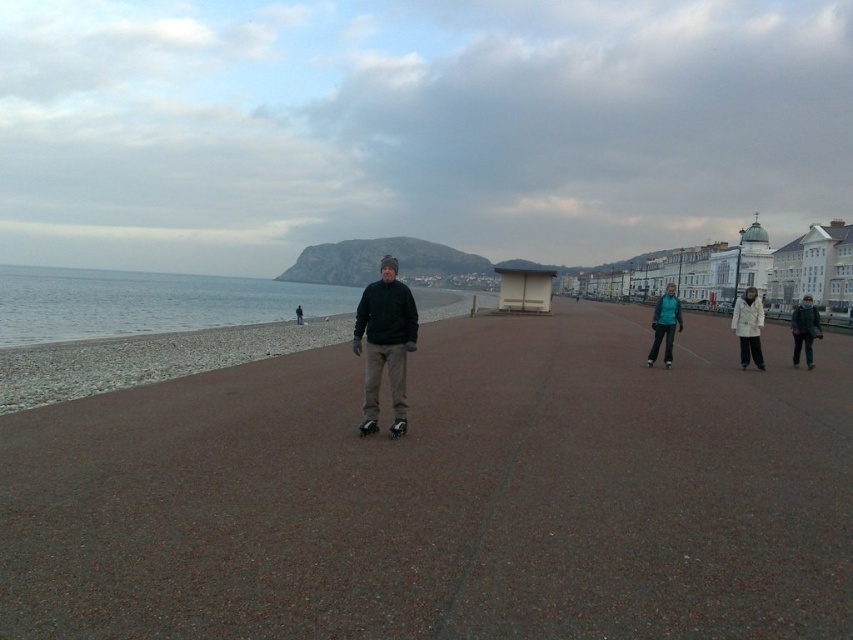
You are a delivery person who needs to skate along the brown textured pavement at center while avoiding the dark gray hoodie at center. Since the pavement is wider than the hoodie, can you safely pass around it on either side?

The brown textured pavement at center is wider than the dark gray hoodie at center, so yes, you can safely pass around it on either side.

You are standing on the brown textured pavement at center. If you look directly ahead, which direction would you face? Please answer based on the scene description and the coordinates provided in the objects description.

Since the brown textured pavement at center is located at coordinates point (445,496), facing directly ahead would mean looking towards the sea, as the promenade is by the sea and the pavement is at the center of the scene.

Looking at this image, you are a photographer planning to take a photo of the dark blue jacket at right and the brown textured pavement at center. Which object should be placed closer to the camera to ensure both are in focus?

The dark blue jacket at right is taller than the brown textured pavement at center, so placing the dark blue jacket at right closer to the camera will help ensure both are in focus.